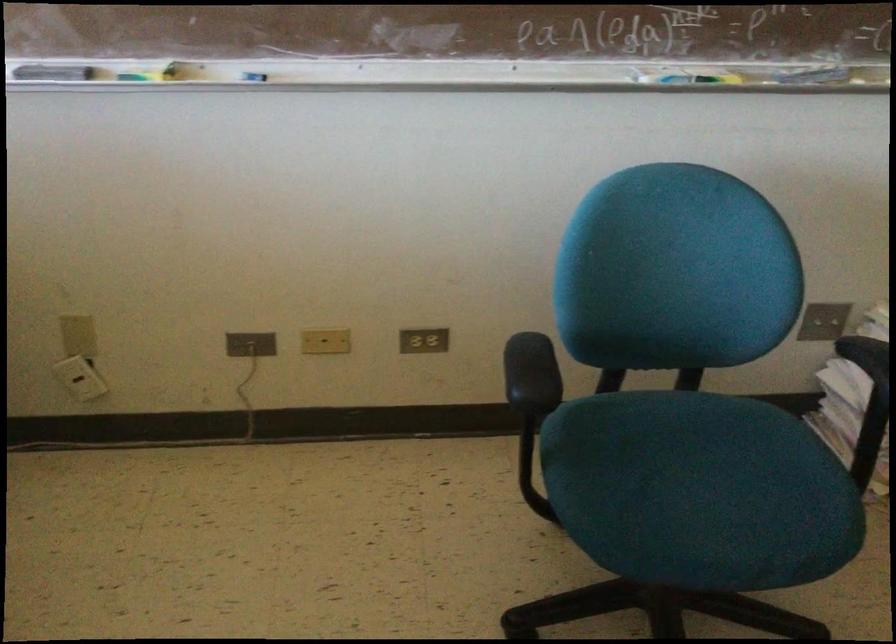
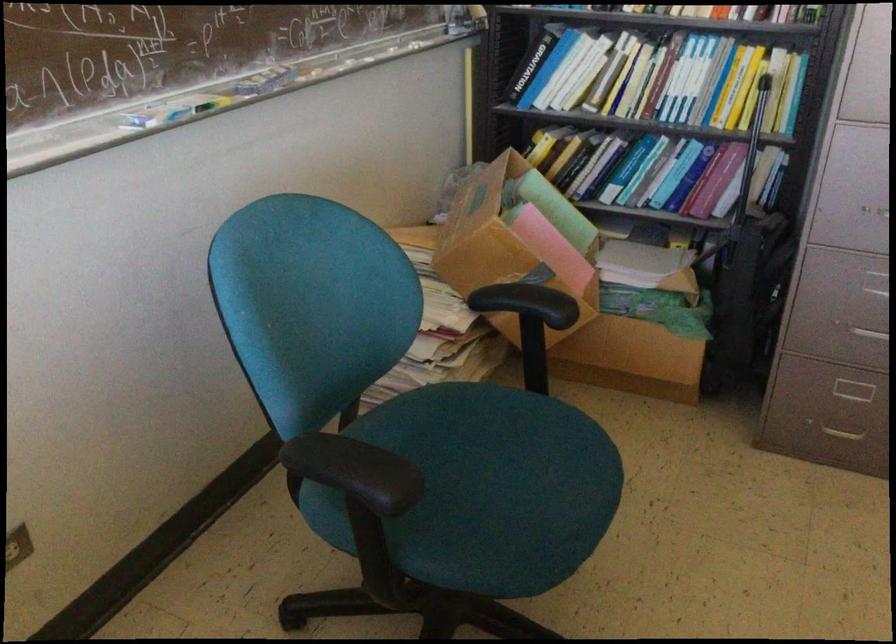
The point at (796, 75) is marked in the first image. Where is the corresponding point in the second image?

(264, 80)